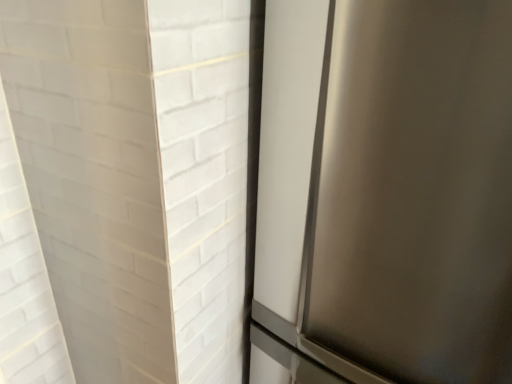
The width and height of the screenshot is (512, 384). Describe the element at coordinates (388, 187) in the screenshot. I see `stainless steel refrigerator door at center` at that location.

At what (x,y) coordinates should I click in order to perform the action: click on stainless steel refrigerator door at center. Please return your answer as a coordinate pair (x, y). Image resolution: width=512 pixels, height=384 pixels. Looking at the image, I should click on (388, 187).

The height and width of the screenshot is (384, 512). What are the coordinates of `stainless steel refrigerator door at center` in the screenshot? It's located at (388, 187).